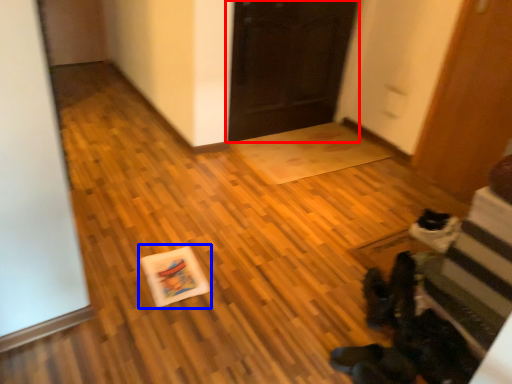
Question: Which point is further to the camera, door (highlighted by a red box) or postcard (highlighted by a blue box)?

Choices:
 (A) door
 (B) postcard

Answer: (A)